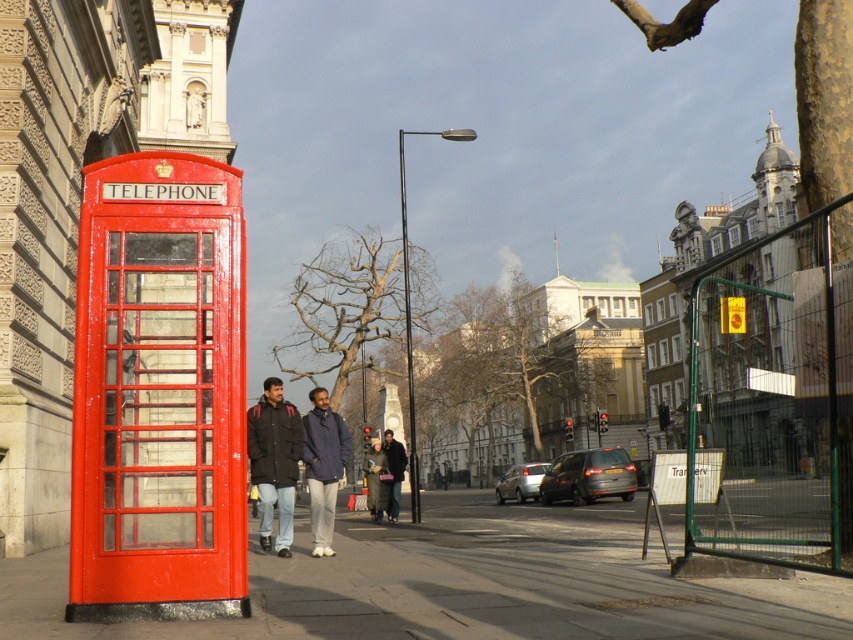
Question: Does dark brown leather jacket at center appear over blue fabric jacket at center?

Choices:
 (A) no
 (B) yes

Answer: (B)

Question: Is smooth concrete sidewalk at lower left wider than blue fabric jacket at center?

Choices:
 (A) yes
 (B) no

Answer: (A)

Question: Which object is farther from the camera taking this photo?

Choices:
 (A) blue fabric jacket at center
 (B) dark gray wool coat at center
 (C) dark brown leather jacket at center

Answer: (B)

Question: Is dark brown leather jacket at center in front of dark gray wool coat at center?

Choices:
 (A) no
 (B) yes

Answer: (B)

Question: Which point is closer to the camera taking this photo?

Choices:
 (A) (312, 461)
 (B) (398, 454)
 (C) (260, 586)
 (D) (265, 472)

Answer: (C)

Question: Among these points, which one is farthest from the camera?

Choices:
 (A) (566, 570)
 (B) (392, 451)
 (C) (252, 417)

Answer: (B)